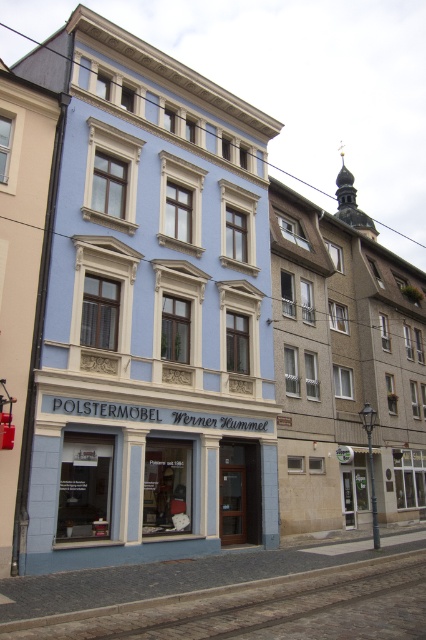
Describe the element at coordinates (345, 365) in the screenshot. I see `brown stone building at right` at that location.

Can you confirm if brown stone building at right is thinner than blue matte storefront at center?

In fact, brown stone building at right might be wider than blue matte storefront at center.

Measure the distance between brown stone building at right and camera.

A distance of 23.53 meters exists between brown stone building at right and camera.

Where is `brown stone building at right`? This screenshot has width=426, height=640. brown stone building at right is located at coordinates (345, 365).